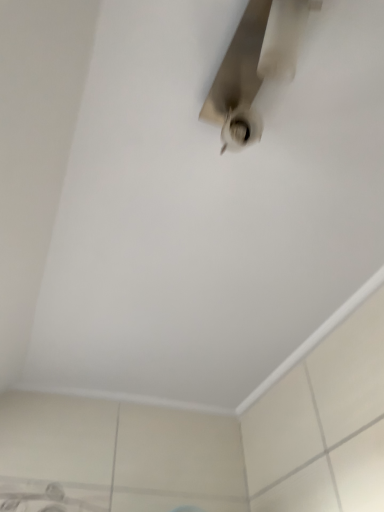
Locate an element on the screen. The image size is (384, 512). white matte shower head at upper center is located at coordinates pyautogui.click(x=254, y=66).

What is the approximate width of white matte shower head at upper center?

white matte shower head at upper center is 6.22 centimeters wide.

The width and height of the screenshot is (384, 512). What do you see at coordinates (254, 66) in the screenshot? I see `white matte shower head at upper center` at bounding box center [254, 66].

Locate an element on the screen. white matte shower head at upper center is located at coordinates (254, 66).